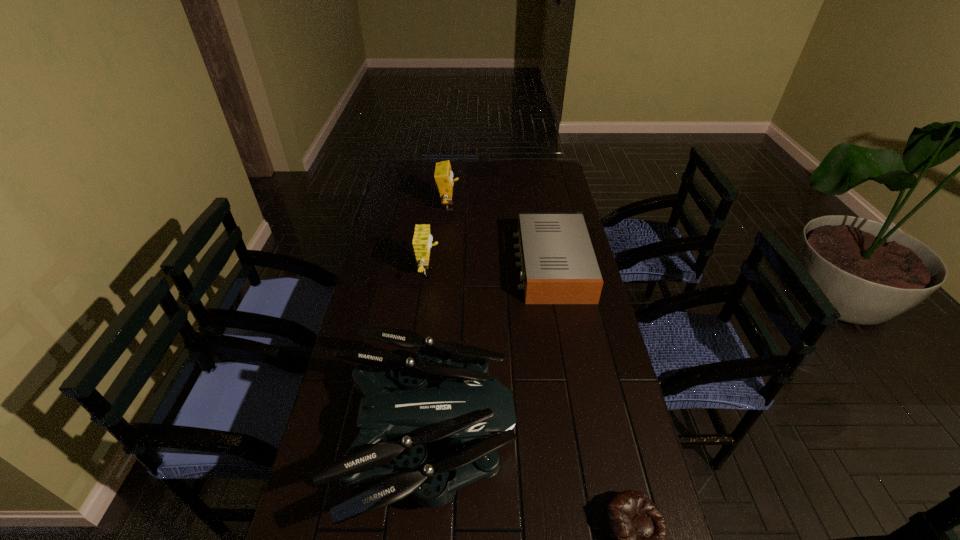
Where is `the farthest object`? the farthest object is located at coordinates (443, 175).

I want to click on the nearer sponge, so (x=422, y=240).

The height and width of the screenshot is (540, 960). Identify the location of radio receiver. (559, 266).

Find the location of `free spot located 0.160m on the face of the farthest object`. free spot located 0.160m on the face of the farthest object is located at coordinates (497, 207).

Locate an element on the screen. Image resolution: width=960 pixels, height=540 pixels. vacant region located on the front-facing side of the nearer sponge is located at coordinates (522, 273).

I want to click on vacant area situated on the control panel of the radio receiver, so click(x=466, y=265).

Where is `vacant region located 0.230m on the control panel of the radio receiver`? The width and height of the screenshot is (960, 540). vacant region located 0.230m on the control panel of the radio receiver is located at coordinates (452, 265).

Where is `vacant space located on the control panel of the radio receiver`? vacant space located on the control panel of the radio receiver is located at coordinates (471, 265).

This screenshot has width=960, height=540. I want to click on object present at the right edge, so click(559, 266).

Locate an element on the screen. Image resolution: width=960 pixels, height=540 pixels. vacant space at the far edge of the desktop is located at coordinates (494, 164).